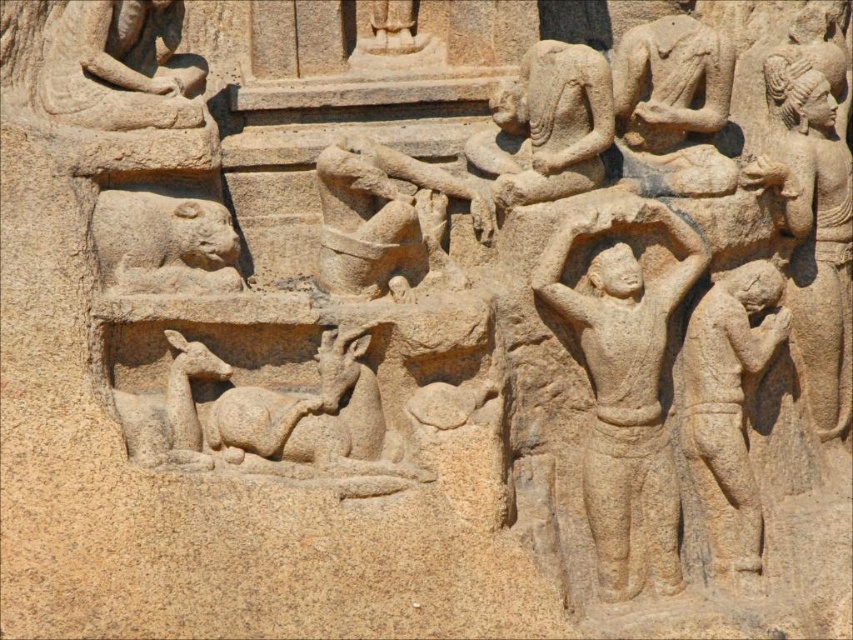
Question: Does smooth beige statue at right lie in front of smooth stone figure at right?

Choices:
 (A) no
 (B) yes

Answer: (A)

Question: Estimate the real-world distances between objects in this image. Which object is farther from the smooth stone figure at center?

Choices:
 (A) smooth stone lion at lower left
 (B) smooth stone figure at right
 (C) smooth beige statue at right

Answer: (A)

Question: Which point is farther from the camera taking this photo?

Choices:
 (A) (129, 61)
 (B) (170, 228)
 (C) (846, 168)
 (D) (595, 420)

Answer: (C)

Question: Estimate the real-world distances between objects in this image. Which object is closer to the smooth beige statue at right?

Choices:
 (A) smooth stone figure at center
 (B) smooth stone lion at lower left
 (C) smooth stone figure at right
 (D) smooth stone figure at upper left

Answer: (C)

Question: Considering the relative positions of smooth stone figure at center and smooth stone lion at lower left in the image provided, where is smooth stone figure at center located with respect to smooth stone lion at lower left?

Choices:
 (A) left
 (B) right

Answer: (B)

Question: Observing the image, what is the correct spatial positioning of smooth beige statue at right in reference to smooth stone figure at upper left?

Choices:
 (A) below
 (B) above

Answer: (A)